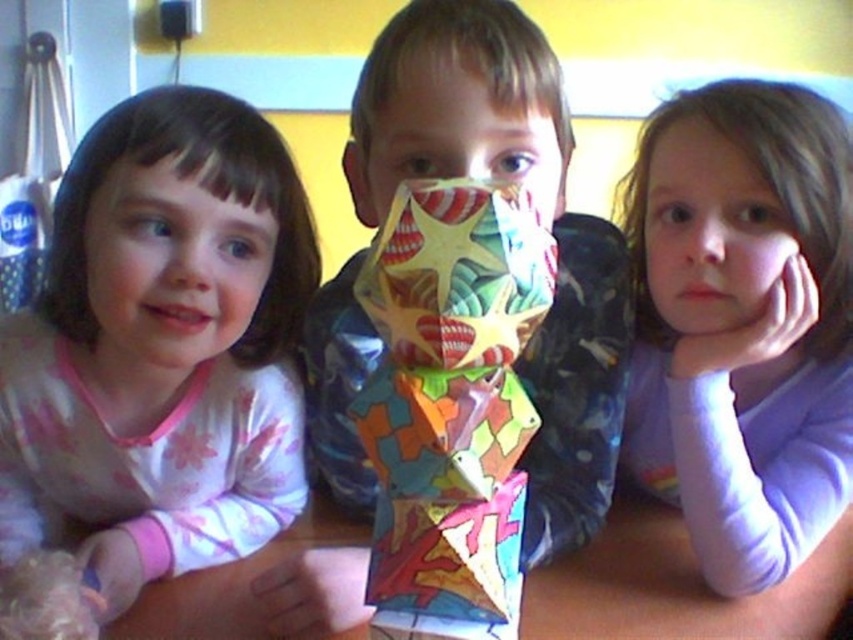
You are a photographer trying to capture a group photo of the matte pink pajamas at left and the smooth skin face at center. Since you want to ensure both subjects are visible, you need to know their positions relative to each other. Based on the scene, which of the two is located more to the left?

The matte pink pajamas at left is positioned on the left side of smooth skin face at center, so the matte pink pajamas at left is more to the left.

You are a photographer trying to capture a closeup of the purple soft fabric at upper right without including the matte pink pajamas at left in the frame. Is this possible based on their positions?

The matte pink pajamas at left is closer to the viewer than the purple soft fabric at upper right, so it would block the view of the purple soft fabric at upper right. Therefore, capturing a closeup of the purple soft fabric at upper right without including the matte pink pajamas at left is not possible.

You are a parent trying to place a small toy on the wooden table at center without it falling off. The toy requires at least 10 inches of space. Can the purple soft fabric at upper right be used as a reference to determine if there is enough space?

The purple soft fabric at upper right is only 8.82 inches from the wooden table at center, which is less than the required 10 inches. Therefore, there isn not enough space to place the toy safely without it falling off.